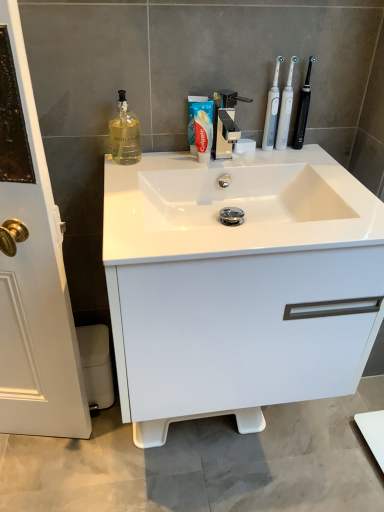
You are a GUI agent. You are given a task and a screenshot of the screen. Output one action in this format:
    pyautogui.click(x=<x>, y=<y>)
    Task: Click on the vacant space to the right of translucent glass bottle at upper left
    
    Given the screenshot: What is the action you would take?
    pyautogui.click(x=166, y=161)